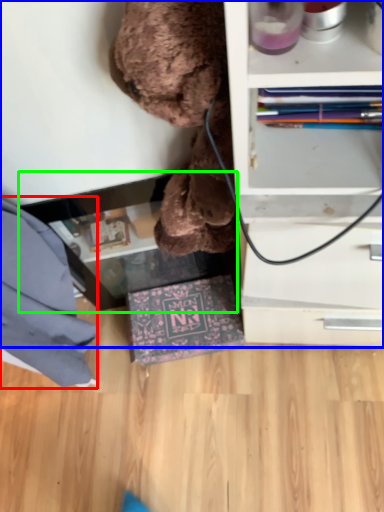
Question: Estimate the real-world distances between objects in this image. Which object is closer to clothe (highlighted by a red box), shelf (highlighted by a blue box) or table (highlighted by a green box)?

Choices:
 (A) shelf
 (B) table

Answer: (B)